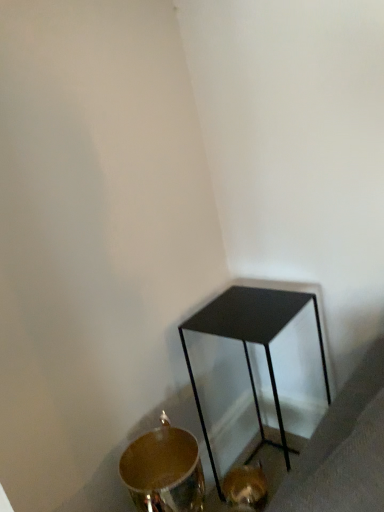
At what (x,y) coordinates should I click in order to perform the action: click on matte black stool at center. Please return your answer as a coordinate pair (x, y). This screenshot has width=384, height=512. Looking at the image, I should click on (251, 342).

This screenshot has height=512, width=384. What do you see at coordinates (251, 342) in the screenshot? I see `matte black stool at center` at bounding box center [251, 342].

The height and width of the screenshot is (512, 384). I want to click on matte black stool at center, so click(251, 342).